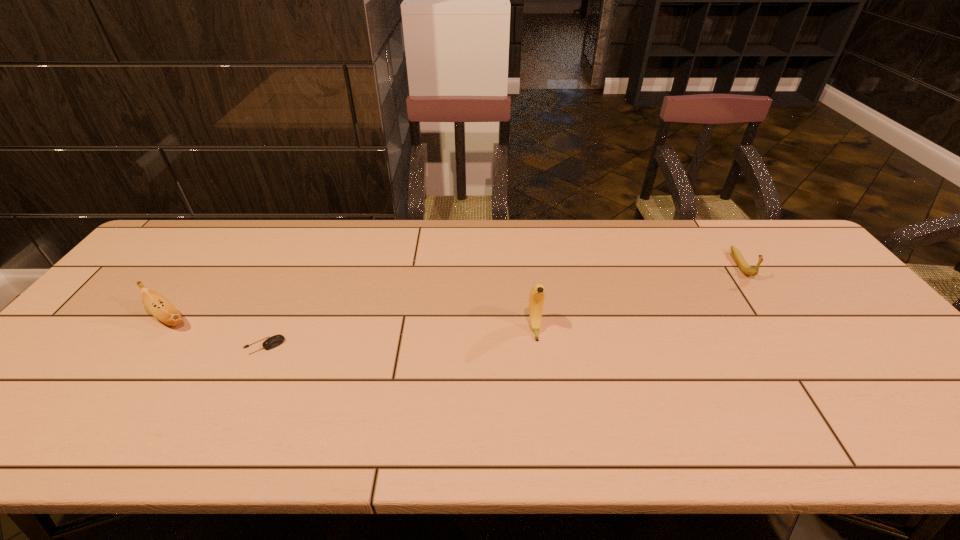
The image size is (960, 540). What are the coordinates of `vacant space located 0.110m on the right of the second object from left to right` in the screenshot? It's located at [327, 346].

What are the coordinates of `object positioned at the far edge` in the screenshot? It's located at (741, 263).

Image resolution: width=960 pixels, height=540 pixels. In order to click on object present at the left edge in this screenshot , I will do point(157,305).

Find the location of a particular element. The image size is (960, 540). blank area at the far edge is located at coordinates (222, 232).

The height and width of the screenshot is (540, 960). Find the location of `free space at the near edge`. free space at the near edge is located at coordinates (201, 437).

In the image, there is a desktop. Where is `free space at the far right corner`? This screenshot has width=960, height=540. free space at the far right corner is located at coordinates (757, 236).

Where is `vacant space in between the second banana from right to left and the mouse`? The image size is (960, 540). vacant space in between the second banana from right to left and the mouse is located at coordinates (399, 338).

Locate an element on the screen. This screenshot has width=960, height=540. vacant region between the mouse and the farthest object is located at coordinates (502, 306).

This screenshot has height=540, width=960. In order to click on free space between the shortest object and the third object from left to right in this screenshot , I will do `click(399, 338)`.

You are a GUI agent. You are given a task and a screenshot of the screen. Output one action in this format:
    pyautogui.click(x=<x>, y=<y>)
    Task: Click on the free area in between the shortest object and the farthest banana
    
    Given the screenshot: What is the action you would take?
    pyautogui.click(x=502, y=306)